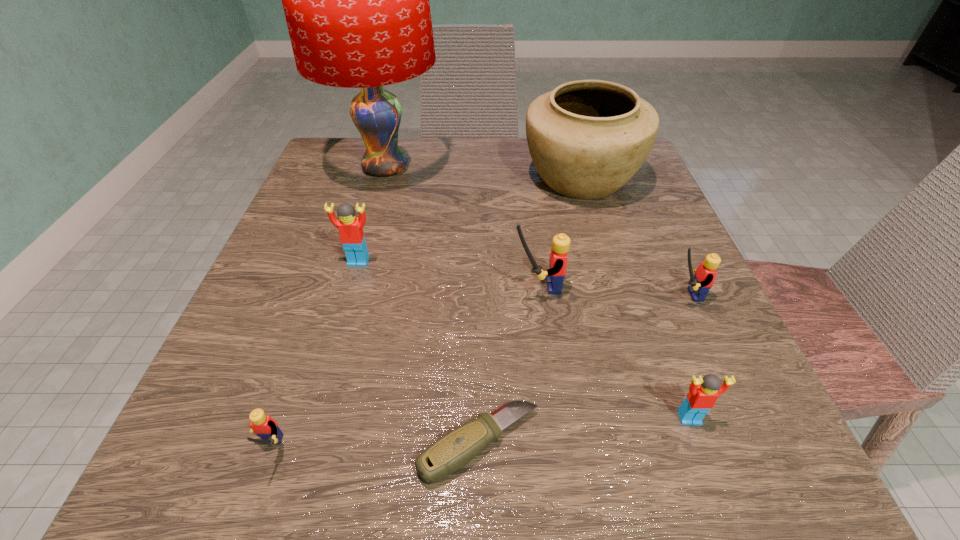
I want to click on the leftmost yellow Lego, so click(x=265, y=427).

Where is `the nearest yellow Lego`? The width and height of the screenshot is (960, 540). the nearest yellow Lego is located at coordinates (265, 427).

This screenshot has height=540, width=960. I want to click on gray pocketknife, so click(452, 451).

In order to click on pocketknife in this screenshot , I will do `click(452, 451)`.

This screenshot has height=540, width=960. Find the location of `vacant position located on the front-facing side of the lampshade`. vacant position located on the front-facing side of the lampshade is located at coordinates (599, 167).

I want to click on vacant space located 0.170m on the left of the pottery, so click(x=444, y=177).

This screenshot has width=960, height=540. Find the location of `free space located on the front-facing side of the biggest yellow Lego`. free space located on the front-facing side of the biggest yellow Lego is located at coordinates (474, 287).

Where is `vacant space situated 0.330m on the front-facing side of the biggest yellow Lego`? This screenshot has height=540, width=960. vacant space situated 0.330m on the front-facing side of the biggest yellow Lego is located at coordinates (310, 287).

You are a GUI agent. You are given a task and a screenshot of the screen. Output one action in this format:
    pyautogui.click(x=<x>, y=<y>)
    Task: Click on the vacant point located on the front-facing side of the biggest yellow Lego
    This screenshot has height=540, width=960.
    Given the screenshot: What is the action you would take?
    pyautogui.click(x=316, y=287)

The height and width of the screenshot is (540, 960). I want to click on free space located 0.110m on the face of the left red Lego, so click(343, 316).